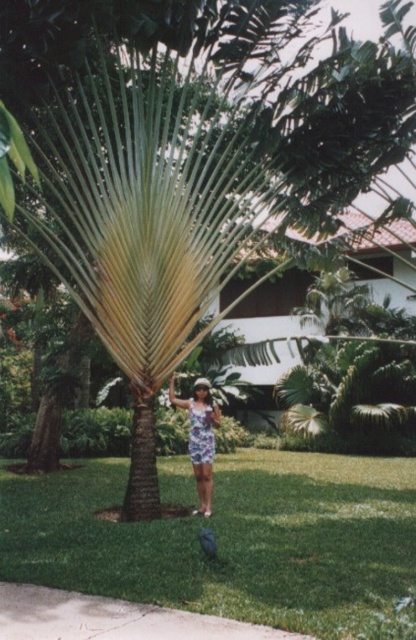
You are standing at the point marked by the coordinates point (111,618) in the tropical garden. Looking around, you see the palm tree with fan leaves and a person in a floral dress. What is the direction of the palm tree relative to your current position?

The palm tree with fan leaves is located to the north of the point (111,618), as the point marks the concrete sidewalk at lower center, which is typically south in an image coordinate system.

You are a gardener who needs to plant a new flower bed. You have a choice between the green grass at center and the concrete sidewalk at lower center. Which location would you choose and why?

The gardener should choose the green grass at center because it has a larger size compared to the concrete sidewalk at lower center, making it more suitable for planting a flower bed.